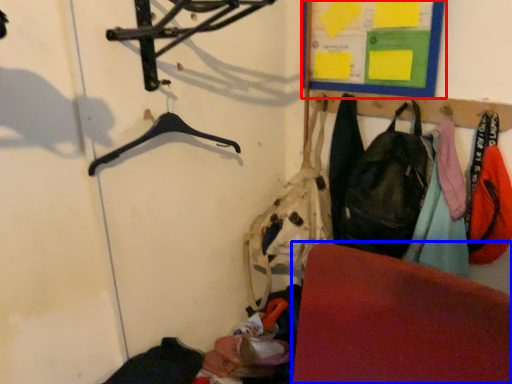
Question: Which point is further to the camera, bulletin board (highlighted by a red box) or furniture (highlighted by a blue box)?

Choices:
 (A) bulletin board
 (B) furniture

Answer: (A)